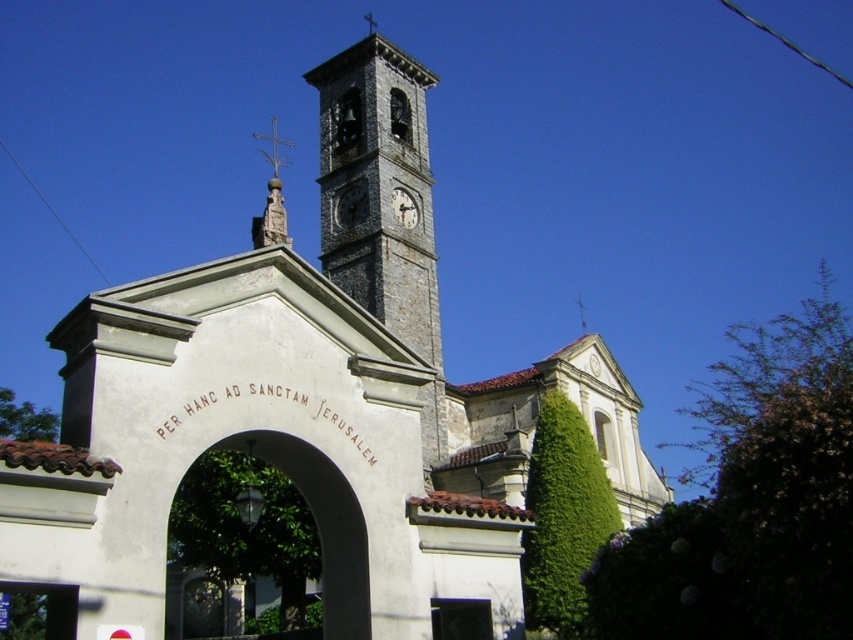
Question: Which object appears farthest from the camera in this image?

Choices:
 (A) polished gold cross at center
 (B) stone clock tower at center
 (C) gray stone clock at center

Answer: (C)

Question: Is stone clock tower at center to the left of gray stone clock at center from the viewer's perspective?

Choices:
 (A) yes
 (B) no

Answer: (A)

Question: Estimate the real-world distances between objects in this image. Which object is farther from the gray stone clock at center?

Choices:
 (A) polished gold cross at center
 (B) stone clock tower at center

Answer: (A)

Question: Can you confirm if stone clock tower at center is bigger than gray stone clock at center?

Choices:
 (A) no
 (B) yes

Answer: (B)

Question: Does stone clock tower at center have a lesser width compared to gray stone clock at center?

Choices:
 (A) yes
 (B) no

Answer: (B)

Question: Estimate the real-world distances between objects in this image. Which object is farther from the polished gold cross at center?

Choices:
 (A) gray stone clock at center
 (B) stone clock tower at center

Answer: (B)